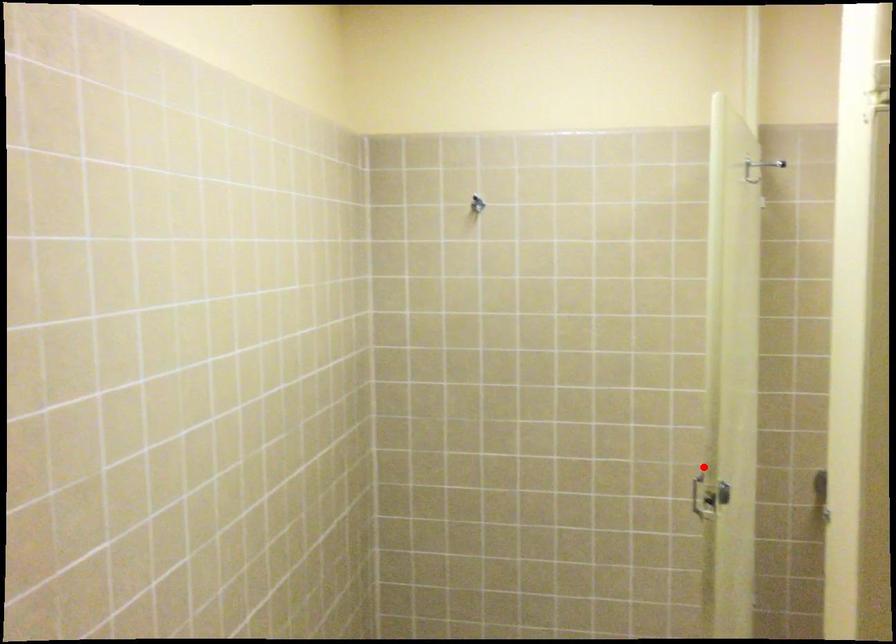
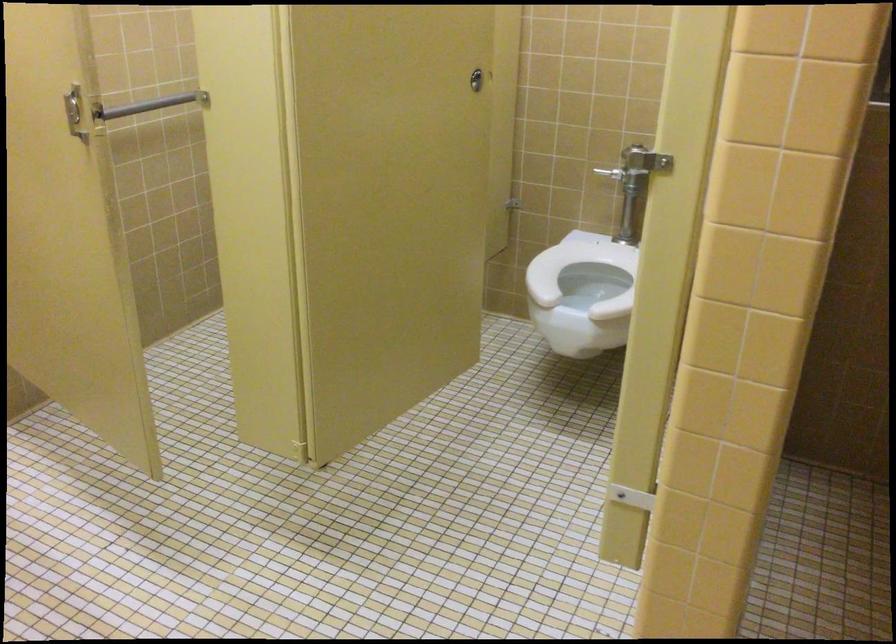
Locate, in the second image, the point that corresponds to the highlighted location in the first image.

(74, 111)